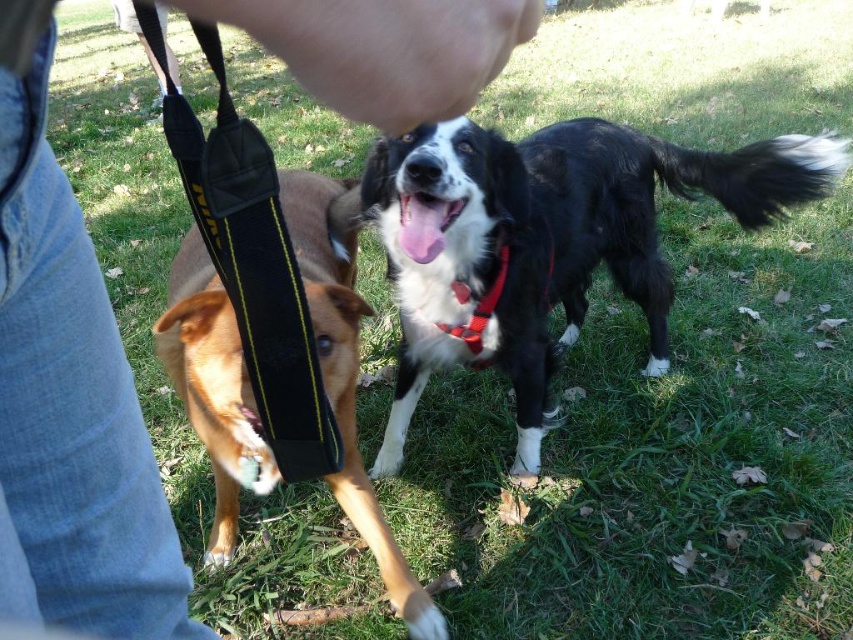
You are a photographer trying to capture a closeup of the black neoprene strap at left. Based on the scene description, what are the coordinates where you should focus your camera?

The coordinates to focus on are (251, 260).

You are a dog owner trying to secure your dog with the black neoprene strap at left. You notice the pink rubber dog mouth at center nearby. Is the strap between you and the dog mouth, or behind it?

The black neoprene strap at left is in front of the pink rubber dog mouth at center, so the strap is between you and the dog mouth.

You are standing in the grassy area and see two points marked in the image. Which point is closer to you, point (566, 292) or point (190, 352)?

Point (566, 292) is further to the viewer than point (190, 352), so the closer point to you is point (566, 292).